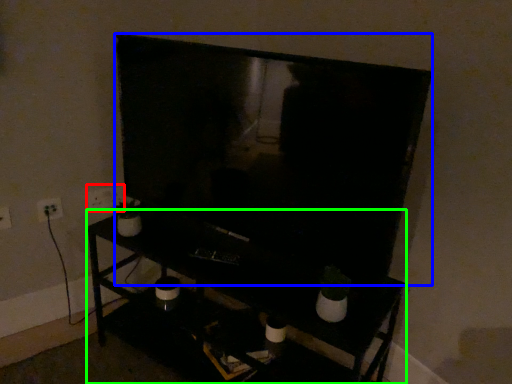
Question: Which is farther away from electric outlet (highlighted by a red box)? television (highlighted by a blue box) or furniture (highlighted by a green box)?

Choices:
 (A) television
 (B) furniture

Answer: (A)